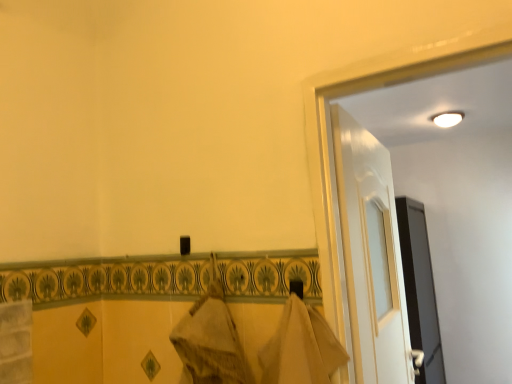
What do you see at coordinates (447, 118) in the screenshot?
I see `white glossy light at upper right` at bounding box center [447, 118].

What do you see at coordinates (370, 254) in the screenshot? I see `white glossy door at upper right` at bounding box center [370, 254].

This screenshot has height=384, width=512. Describe the element at coordinates (420, 289) in the screenshot. I see `black glossy screen door at right` at that location.

Where is `white glossy light at upper right`? white glossy light at upper right is located at coordinates (447, 118).

How many degrees apart are the facing directions of black glossy screen door at right and white glossy light at upper right?

black glossy screen door at right and white glossy light at upper right are facing 92.7 degrees away from each other.

Is black glossy screen door at right to the left of white glossy light at upper right from the viewer's perspective?

Yes, black glossy screen door at right is to the left of white glossy light at upper right.

Is black glossy screen door at right shorter than white glossy light at upper right?

Incorrect, the height of black glossy screen door at right does not fall short of that of white glossy light at upper right.

How distant is black glossy screen door at right from white glossy light at upper right?

4.49 feet.

Can you tell me how much white glossy light at upper right and white glossy door at upper right differ in facing direction?

They differ by 92.7 degrees in their facing directions.

From the picture: Is white glossy light at upper right shorter than white glossy door at upper right?

Correct, white glossy light at upper right is not as tall as white glossy door at upper right.

Considering the positions of objects white glossy light at upper right and white glossy door at upper right in the image provided, who is in front, white glossy light at upper right or white glossy door at upper right?

white glossy door at upper right is more forward.

From a real-world perspective, is white glossy light at upper right on white glossy door at upper right?

Indeed, from a real-world perspective, white glossy light at upper right stands above white glossy door at upper right.

Looking at this image, between black glossy screen door at right and white glossy door at upper right, which one is positioned in front?

white glossy door at upper right is in front.

What are the coordinates of `door lying in front of the black glossy screen door at right` in the screenshot? It's located at (370, 254).

Considering the relative sizes of black glossy screen door at right and white glossy door at upper right in the image provided, is black glossy screen door at right smaller than white glossy door at upper right?

Incorrect, black glossy screen door at right is not smaller in size than white glossy door at upper right.

From the image's perspective, is black glossy screen door at right above or below white glossy door at upper right?

black glossy screen door at right is situated lower than white glossy door at upper right in the image.

From the image's perspective, which one is positioned higher, white glossy door at upper right or black glossy screen door at right?

white glossy door at upper right appears higher in the image.

In order to click on screen door on the right of white glossy door at upper right in this screenshot , I will do `click(420, 289)`.

Would you consider white glossy door at upper right to be distant from black glossy screen door at right?

Yes, white glossy door at upper right is far from black glossy screen door at right.

Looking at their sizes, would you say white glossy light at upper right is wider or thinner than black glossy screen door at right?

white glossy light at upper right is thinner than black glossy screen door at right.

How different are the orientations of white glossy light at upper right and black glossy screen door at right in degrees?

92.7 degrees separate the facing orientations of white glossy light at upper right and black glossy screen door at right.

Does white glossy light at upper right have a smaller size compared to black glossy screen door at right?

Correct, white glossy light at upper right occupies less space than black glossy screen door at right.

Can you tell me how much white glossy door at upper right and white glossy light at upper right differ in facing direction?

The angle between the facing direction of white glossy door at upper right and the facing direction of white glossy light at upper right is 92.7 degrees.

Can you confirm if white glossy door at upper right is positioned to the right of white glossy light at upper right?

No, white glossy door at upper right is not to the right of white glossy light at upper right.

Identify the location of light that is behind the white glossy door at upper right. This screenshot has width=512, height=384. (447, 118).

Does white glossy door at upper right have a lesser height compared to white glossy light at upper right?

Incorrect, the height of white glossy door at upper right does not fall short of that of white glossy light at upper right.

The height and width of the screenshot is (384, 512). Identify the location of light above the black glossy screen door at right (from the image's perspective). pyautogui.click(x=447, y=118).

You are a GUI agent. You are given a task and a screenshot of the screen. Output one action in this format:
    pyautogui.click(x=<x>, y=<y>)
    Task: Click on the light that appears on the right of white glossy door at upper right
    
    Given the screenshot: What is the action you would take?
    pyautogui.click(x=447, y=118)

When comparing their distances from black glossy screen door at right, does white glossy door at upper right or white glossy light at upper right seem closer?

white glossy light at upper right lies closer to black glossy screen door at right than the other object.

From the image, which object appears to be nearer to white glossy light at upper right, white glossy door at upper right or black glossy screen door at right?

Based on the image, black glossy screen door at right appears to be nearer to white glossy light at upper right.

In the scene shown: Which object lies further to the anchor point white glossy door at upper right, white glossy light at upper right or black glossy screen door at right?

The object further to white glossy door at upper right is black glossy screen door at right.

Looking at the image, which one is located further to black glossy screen door at right, white glossy light at upper right or white glossy door at upper right?

white glossy door at upper right.

Based on their spatial positions, is black glossy screen door at right or white glossy light at upper right further from white glossy door at upper right?

black glossy screen door at right.

From the image, which object appears to be nearer to white glossy light at upper right, black glossy screen door at right or white glossy door at upper right?

Among the two, black glossy screen door at right is located nearer to white glossy light at upper right.

Locate an element on the screen. screen door between white glossy door at upper right and white glossy light at upper right in the front-back direction is located at coordinates (420, 289).